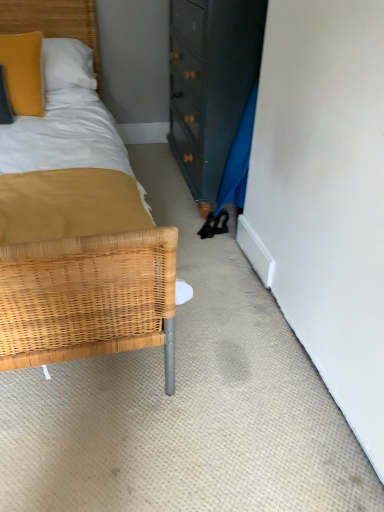
Question: From the image's perspective, is woven wood headboard at upper left beneath matte yellow pillow at upper left?

Choices:
 (A) no
 (B) yes

Answer: (A)

Question: Is matte yellow pillow at upper left completely or partially inside woven wood headboard at upper left?

Choices:
 (A) no
 (B) yes

Answer: (B)

Question: Does woven wood headboard at upper left have a lesser width compared to matte yellow pillow at upper left?

Choices:
 (A) no
 (B) yes

Answer: (A)

Question: Is woven wood headboard at upper left positioned with its back to matte yellow pillow at upper left?

Choices:
 (A) no
 (B) yes

Answer: (A)

Question: Would you say woven wood headboard at upper left is outside matte yellow pillow at upper left?

Choices:
 (A) yes
 (B) no

Answer: (A)

Question: Can you confirm if woven wood headboard at upper left is bigger than matte yellow pillow at upper left?

Choices:
 (A) yes
 (B) no

Answer: (A)

Question: From a real-world perspective, is matte yellow pillow at upper left under woven wood headboard at upper left?

Choices:
 (A) no
 (B) yes

Answer: (A)

Question: Is the position of matte yellow pillow at upper left more distant than that of woven wood headboard at upper left?

Choices:
 (A) yes
 (B) no

Answer: (B)

Question: Is matte yellow pillow at upper left shorter than woven wood headboard at upper left?

Choices:
 (A) no
 (B) yes

Answer: (B)

Question: Is matte yellow pillow at upper left at the right side of woven wood headboard at upper left?

Choices:
 (A) no
 (B) yes

Answer: (A)

Question: From the image's perspective, does matte yellow pillow at upper left appear lower than woven wood headboard at upper left?

Choices:
 (A) yes
 (B) no

Answer: (A)

Question: Does matte yellow pillow at upper left have a smaller size compared to woven wood headboard at upper left?

Choices:
 (A) no
 (B) yes

Answer: (B)

Question: From a real-world perspective, is woven wood headboard at upper left positioned above or below matte yellow pillow at upper left?

Choices:
 (A) below
 (B) above

Answer: (A)